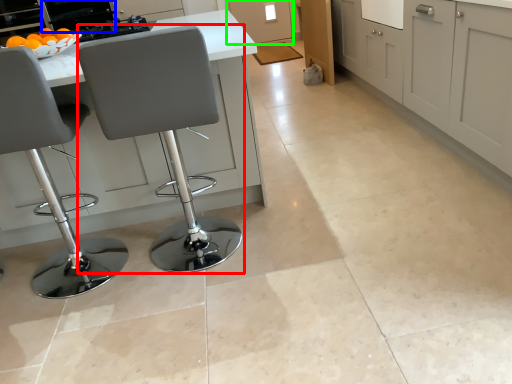
Question: Which object is positioned farthest from chair (highlighted by a red box)? Select from appliance (highlighted by a blue box) and cabinetry (highlighted by a green box).

Choices:
 (A) appliance
 (B) cabinetry

Answer: (B)